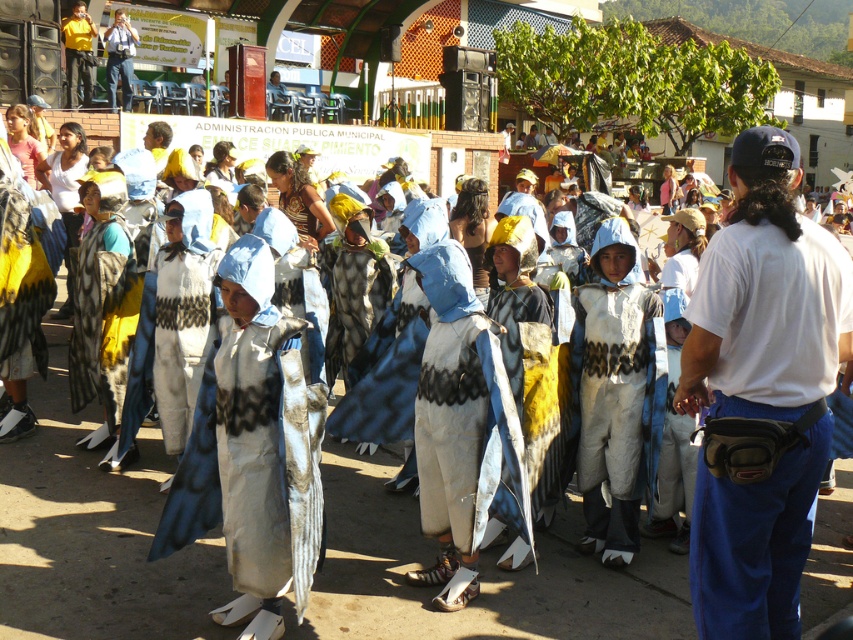
Does white fabric fanny pack at right have a lesser width compared to matte black camera at upper left?

No, white fabric fanny pack at right is not thinner than matte black camera at upper left.

What do you see at coordinates (761, 392) in the screenshot?
I see `white fabric fanny pack at right` at bounding box center [761, 392].

What are the coordinates of `white fabric fanny pack at right` in the screenshot? It's located at (761, 392).

Does point (251, 237) come closer to viewer compared to point (74, 74)?

Yes.

Is white fabric costume at center positioned before yellow shirt at upper left?

Yes, it is.

Where is `white fabric costume at center`? white fabric costume at center is located at coordinates (254, 451).

Is white fabric costume at center to the left of matte black camera at upper left from the viewer's perspective?

No, white fabric costume at center is not to the left of matte black camera at upper left.

Can you confirm if white fabric costume at center is taller than matte black camera at upper left?

No.

Which is behind, point (221, 259) or point (125, 96)?

Positioned behind is point (125, 96).

Where is `white fabric costume at center`? white fabric costume at center is located at coordinates (254, 451).